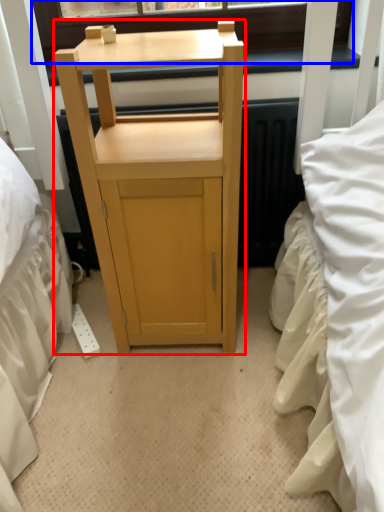
Question: Which point is further to the camera, furniture (highlighted by a red box) or window screen (highlighted by a blue box)?

Choices:
 (A) furniture
 (B) window screen

Answer: (B)